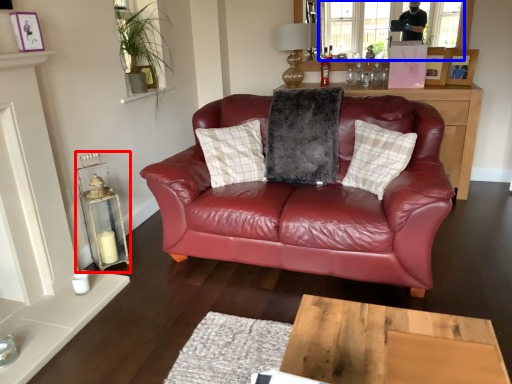
Question: Which of the following is the closest to the observer, candle holder (highlighted by a red box) or window screen (highlighted by a blue box)?

Choices:
 (A) candle holder
 (B) window screen

Answer: (A)